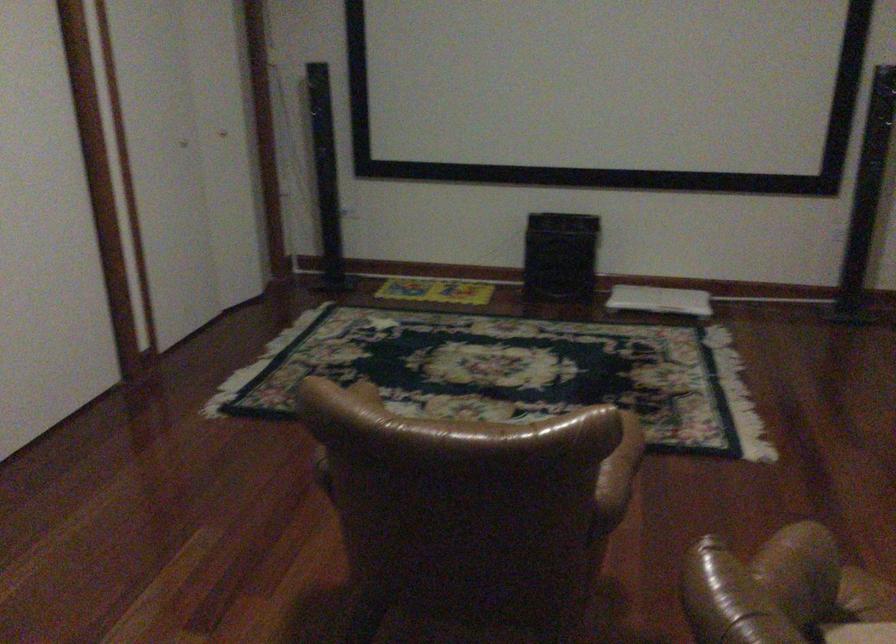
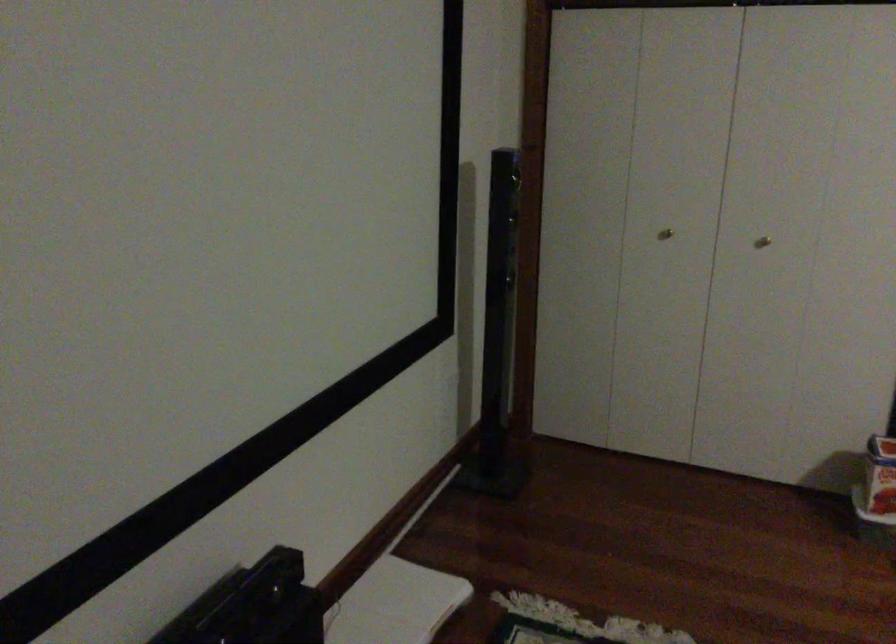
The point at (675, 292) is marked in the first image. Where is the corresponding point in the second image?

(394, 603)